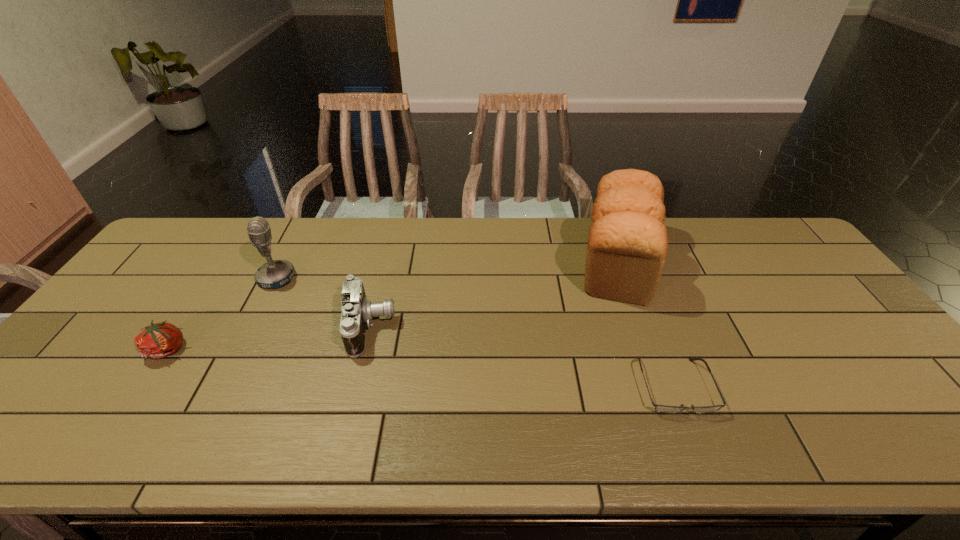
Locate an element on the screen. The width and height of the screenshot is (960, 540). object that is the third closest to the spectacles is located at coordinates pos(275,274).

Where is `the closest object to the second shortest object`? This screenshot has height=540, width=960. the closest object to the second shortest object is located at coordinates (275, 274).

The width and height of the screenshot is (960, 540). Identify the location of free location that satisfies the following two spatial constraints: 1. on the front side of the tallest object; 2. at the lens of the third shortest object. (643, 328).